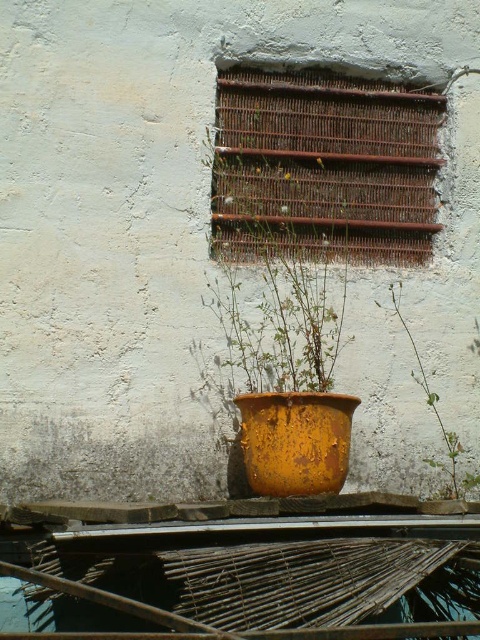
Is rusty metal pot at center positioned before green leafy plant at center?

Yes.

In order to click on rusty metal pot at center in this screenshot , I will do `click(295, 442)`.